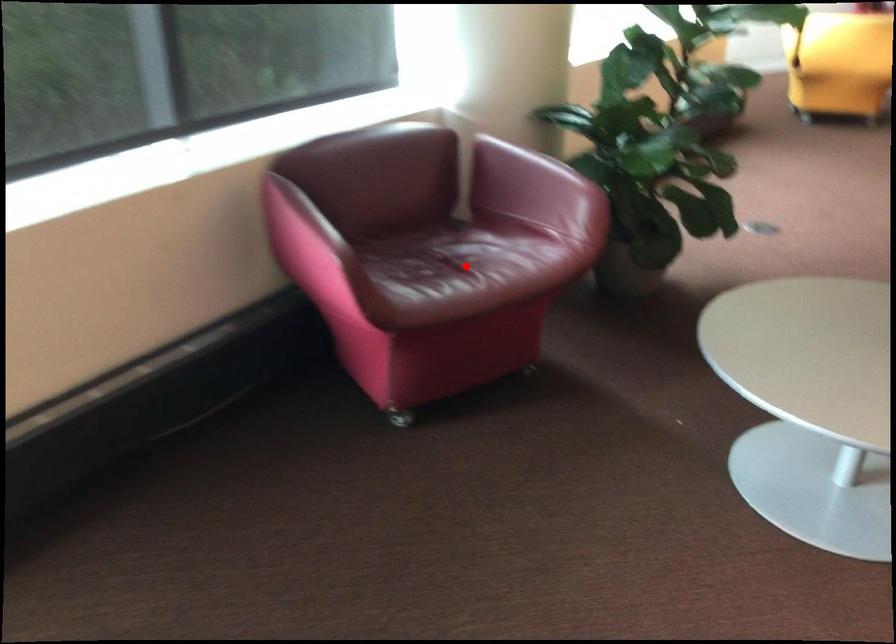
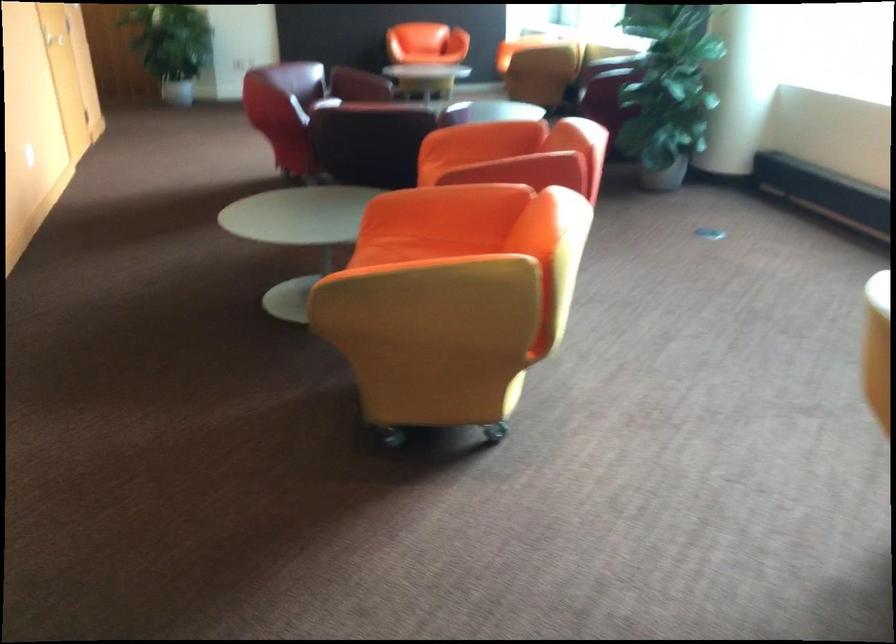
Question: I am providing you with two images of the same scene from different viewpoints. A red point is marked on the first image. Can you still see the location of the red point in image 2?

Choices:
 (A) Yes
 (B) No

Answer: (B)